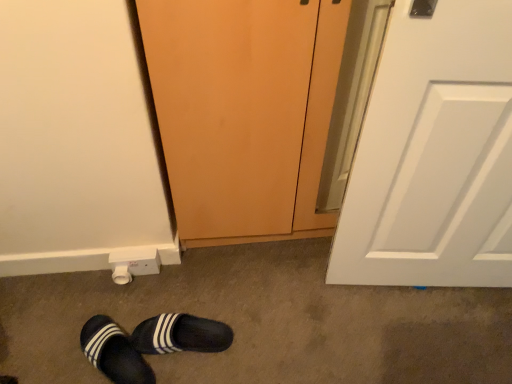
Question: Should I look upward or downward to see white plastic electric outlet at lower left?

Choices:
 (A) up
 (B) down

Answer: (B)

Question: Is black fabric slippers at lower left, arranged as the 1th footwear when viewed from the left, facing towards matte wood screen door at center?

Choices:
 (A) no
 (B) yes

Answer: (A)

Question: Considering the relative positions of black fabric slippers at lower left, marked as the 2th footwear in a right-to-left arrangement, and matte wood screen door at center in the image provided, is black fabric slippers at lower left, marked as the 2th footwear in a right-to-left arrangement, in front of matte wood screen door at center?

Choices:
 (A) yes
 (B) no

Answer: (B)

Question: Can you confirm if black fabric slippers at lower left, marked as the 2th footwear in a right-to-left arrangement, is smaller than matte wood screen door at center?

Choices:
 (A) yes
 (B) no

Answer: (A)

Question: Considering the relative sizes of black fabric slippers at lower left, marked as the 2th footwear in a right-to-left arrangement, and matte wood screen door at center in the image provided, is black fabric slippers at lower left, marked as the 2th footwear in a right-to-left arrangement, bigger than matte wood screen door at center?

Choices:
 (A) yes
 (B) no

Answer: (B)

Question: Is black fabric slippers at lower left, arranged as the 1th footwear when viewed from the left, oriented away from matte wood screen door at center?

Choices:
 (A) yes
 (B) no

Answer: (B)

Question: From a real-world perspective, is white plastic electric outlet at lower left physically above matte wood screen door at center?

Choices:
 (A) yes
 (B) no

Answer: (B)

Question: Does white plastic electric outlet at lower left have a greater height compared to matte wood screen door at center?

Choices:
 (A) yes
 (B) no

Answer: (B)

Question: Does white plastic electric outlet at lower left contain matte wood screen door at center?

Choices:
 (A) no
 (B) yes

Answer: (A)

Question: Considering the relative sizes of white plastic electric outlet at lower left and matte wood screen door at center in the image provided, is white plastic electric outlet at lower left wider than matte wood screen door at center?

Choices:
 (A) no
 (B) yes

Answer: (A)

Question: Is white plastic electric outlet at lower left behind matte wood screen door at center?

Choices:
 (A) yes
 (B) no

Answer: (A)

Question: Considering the relative sizes of white plastic electric outlet at lower left and matte wood screen door at center in the image provided, is white plastic electric outlet at lower left smaller than matte wood screen door at center?

Choices:
 (A) no
 (B) yes

Answer: (B)

Question: Is matte wood screen door at center a part of black suede slippers at lower left, which is the second footwear in left-to-right order?

Choices:
 (A) no
 (B) yes

Answer: (A)